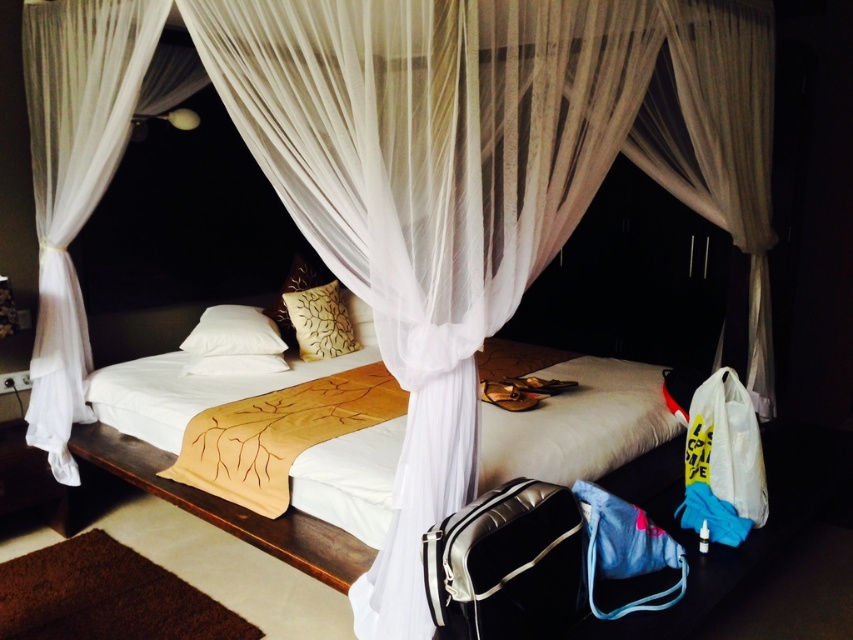
Who is positioned more to the right, white fabric bed at center or white soft pillow at upper left?

Positioned to the right is white fabric bed at center.

Does white fabric bed at center appear on the left side of white soft pillow at upper left?

No, white fabric bed at center is not to the left of white soft pillow at upper left.

Identify the location of white fabric bed at center. This screenshot has height=640, width=853. (578, 424).

Is white soft pillow at upper left taller than white soft pillow at center?

Yes.

Can you confirm if white soft pillow at upper left is wider than white soft pillow at center?

In fact, white soft pillow at upper left might be narrower than white soft pillow at center.

Which is in front, point (267, 336) or point (235, 372)?

Point (235, 372)

The width and height of the screenshot is (853, 640). I want to click on white soft pillow at upper left, so click(233, 332).

Is white fabric bed at center above brown textured pillow at center?

Incorrect, white fabric bed at center is not positioned above brown textured pillow at center.

Does white fabric bed at center come in front of brown textured pillow at center?

Yes, it is.

The image size is (853, 640). Identify the location of white fabric bed at center. (578, 424).